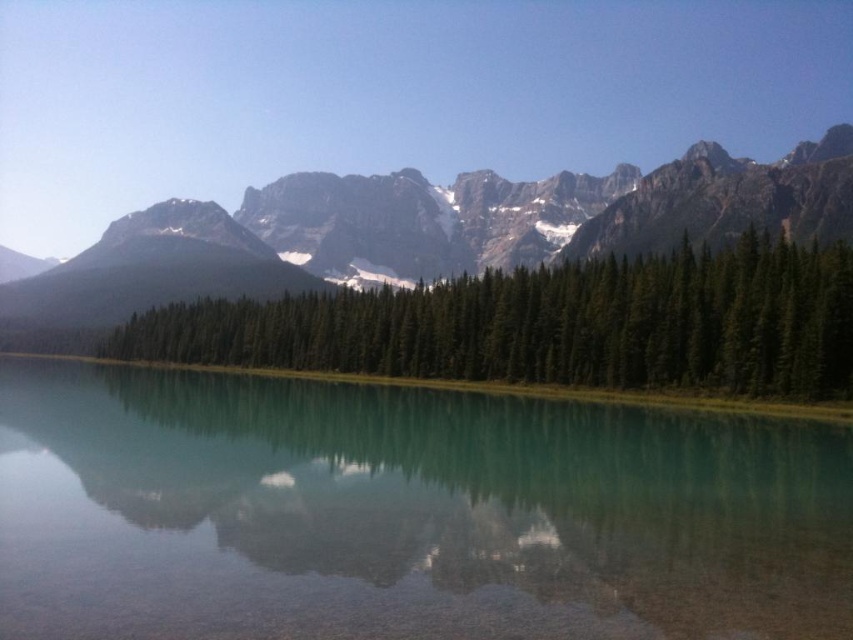
You are standing at the lakeshore and want to determine which object in the scene is taller. You see the green matte trees at center and the rocky mountain range at upper center. Which one is taller?

The green matte trees at center has a lesser height compared to rocky mountain range at upper center, so the rocky mountain range at upper center is taller.

You are standing at the edge of the lake and want to locate two points marked in the image. Which of the two points, point (741, 484) or point (680, 312), is nearer to you?

Point (741, 484) is closer to the viewer than point (680, 312).

You are standing at the lakeshore and want to take a photo that includes both the clear glass water at center and the rocky mountain range at upper center. Which object will occupy more horizontal space in your photo?

The rocky mountain range at upper center will occupy more horizontal space in the photo because it has a greater width than the clear glass water at center.